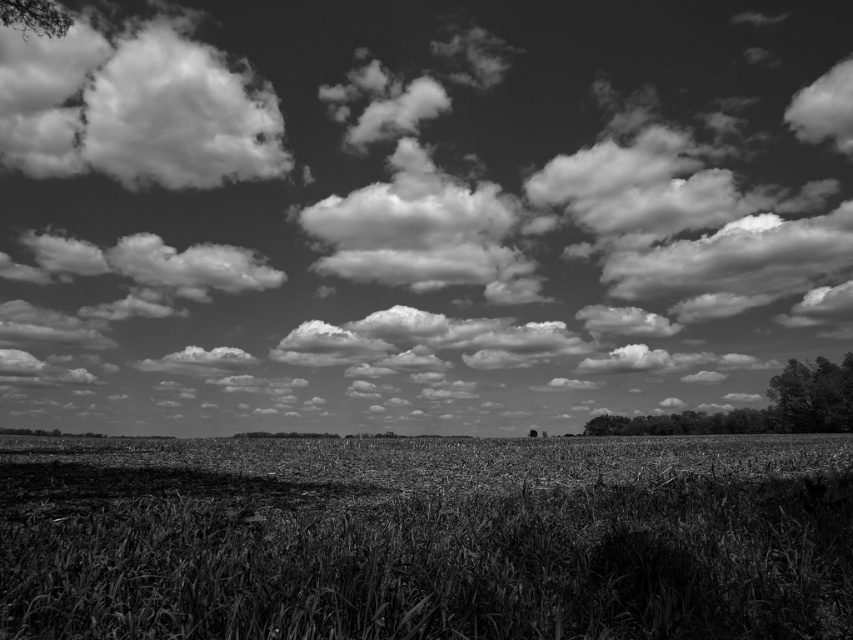
Is the position of fluffy white cloud at upper left less distant than that of dark green textured tree at right?

That is True.

Who is more forward, (73, 61) or (828, 403)?

Positioned in front is point (73, 61).

Where is `fluffy white cloud at upper left`? The width and height of the screenshot is (853, 640). fluffy white cloud at upper left is located at coordinates (134, 109).

Image resolution: width=853 pixels, height=640 pixels. Describe the element at coordinates (811, 396) in the screenshot. I see `dark green textured tree at right` at that location.

Identify the location of dark green textured tree at right. (811, 396).

At what (x,y) coordinates should I click in order to perform the action: click on dark green textured tree at right. Please return your answer as a coordinate pair (x, y). Image resolution: width=853 pixels, height=640 pixels. Looking at the image, I should click on (811, 396).

Consider the image. Can you confirm if grainy brown wheat field at center is taller than dark green textured tree at right?

Incorrect, grainy brown wheat field at center's height is not larger of dark green textured tree at right's.

How much distance is there between grainy brown wheat field at center and dark green textured tree at right?

grainy brown wheat field at center and dark green textured tree at right are 41.66 meters apart.

This screenshot has height=640, width=853. Describe the element at coordinates (426, 538) in the screenshot. I see `grainy brown wheat field at center` at that location.

Where is `grainy brown wheat field at center`? The image size is (853, 640). grainy brown wheat field at center is located at coordinates (426, 538).